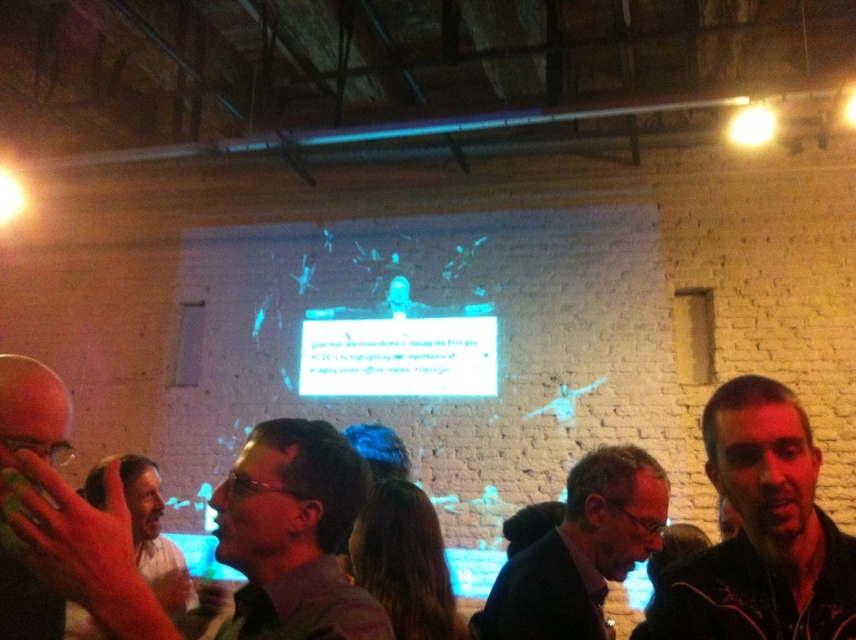
Can you confirm if matte black glasses at center is positioned above smooth skin hand at lower left?

Actually, matte black glasses at center is below smooth skin hand at lower left.

Which is more to the left, matte black glasses at center or smooth skin hand at lower left?

smooth skin hand at lower left is more to the left.

What do you see at coordinates (294, 536) in the screenshot? The height and width of the screenshot is (640, 856). I see `matte black glasses at center` at bounding box center [294, 536].

Identify the location of matte black glasses at center. This screenshot has height=640, width=856. (294, 536).

Can you confirm if matte black glasses at center is shorter than dark blue suit at center?

Indeed, matte black glasses at center has a lesser height compared to dark blue suit at center.

Can you confirm if matte black glasses at center is bigger than dark blue suit at center?

Incorrect, matte black glasses at center is not larger than dark blue suit at center.

Is point (236, 547) farther from viewer compared to point (471, 621)?

No, (236, 547) is in front of (471, 621).

In order to click on matte black glasses at center in this screenshot , I will do `click(294, 536)`.

Between dark blue suit at center and smooth skin hand at lower left, which one is positioned lower?

Positioned lower is dark blue suit at center.

Does dark blue suit at center appear on the right side of smooth skin hand at lower left?

Correct, you'll find dark blue suit at center to the right of smooth skin hand at lower left.

Locate an element on the screen. dark blue suit at center is located at coordinates (581, 550).